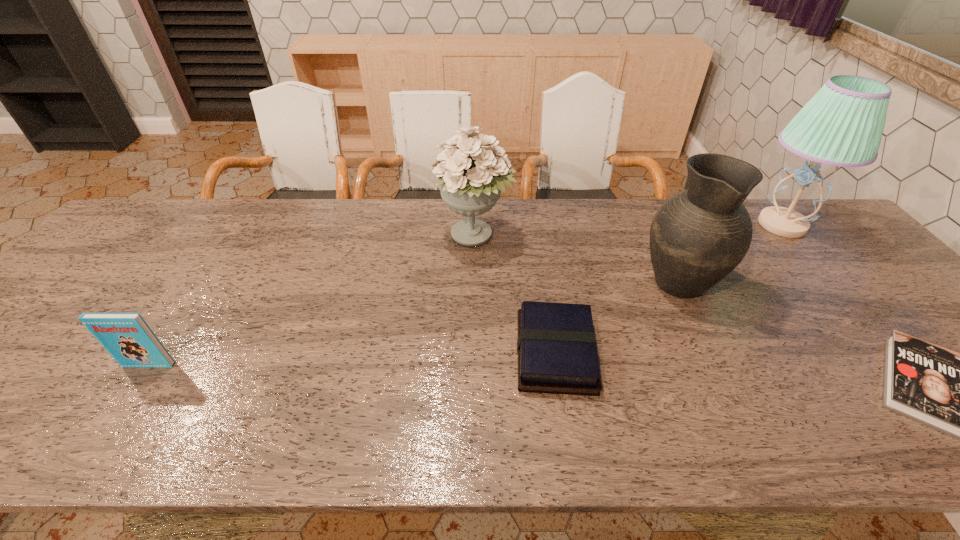
I want to click on the tallest object, so click(842, 125).

In order to click on bouquet in this screenshot , I will do `click(472, 172)`.

You are a GUI agent. You are given a task and a screenshot of the screen. Output one action in this format:
    pyautogui.click(x=<x>, y=<y>)
    Task: Click on the pitcher
    
    Given the screenshot: What is the action you would take?
    pyautogui.click(x=699, y=235)

Locate an element on the screen. The image size is (960, 540). the leftmost book is located at coordinates (127, 338).

Locate an element on the screen. the third shortest object is located at coordinates (127, 338).

Find the location of a particular element. The height and width of the screenshot is (540, 960). the second shortest book is located at coordinates (556, 346).

Locate an element on the screen. The width and height of the screenshot is (960, 540). the second shortest object is located at coordinates (556, 346).

Image resolution: width=960 pixels, height=540 pixels. Find the location of `free space located on the front of the lamp`. free space located on the front of the lamp is located at coordinates pyautogui.click(x=845, y=300).

Image resolution: width=960 pixels, height=540 pixels. Identify the location of vacant space located 0.260m on the left of the bouquet. (349, 237).

I want to click on vacant space located 0.100m on the side of the pitcher with the handle, so click(654, 231).